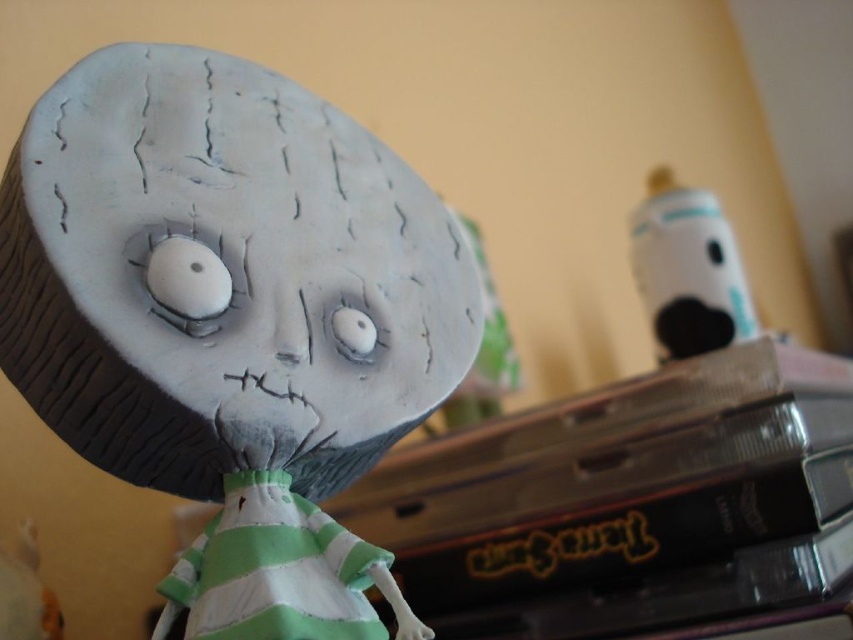
Which is more to the right, matte clay doll at center or white matte baby bottle at upper right?

white matte baby bottle at upper right

Is matte clay doll at center wider than white matte baby bottle at upper right?

Correct, the width of matte clay doll at center exceeds that of white matte baby bottle at upper right.

Between point (15, 333) and point (698, 336), which one is positioned behind?

Point (698, 336)

At what (x,y) coordinates should I click in order to perform the action: click on matte clay doll at center. Please return your answer as a coordinate pair (x, y). Image resolution: width=853 pixels, height=640 pixels. Looking at the image, I should click on (223, 276).